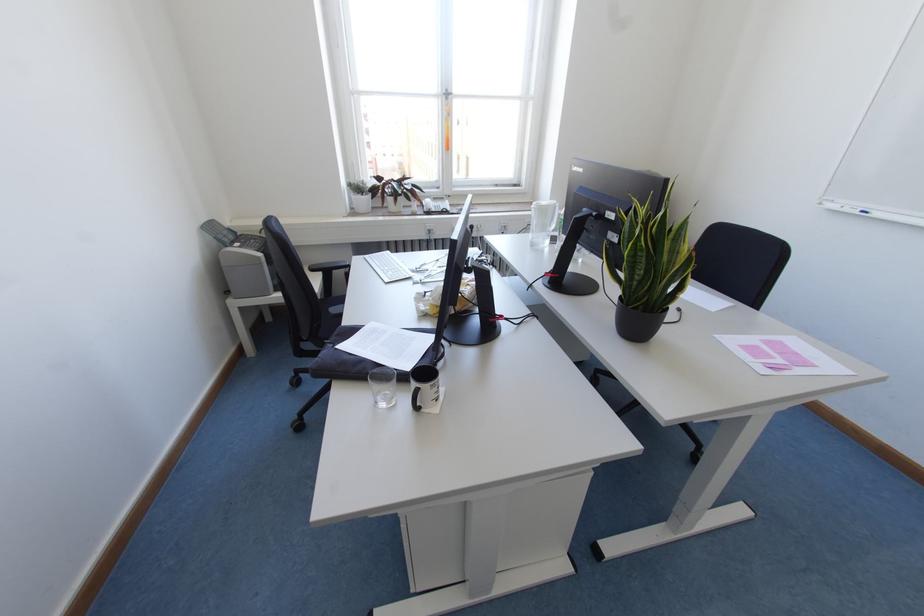
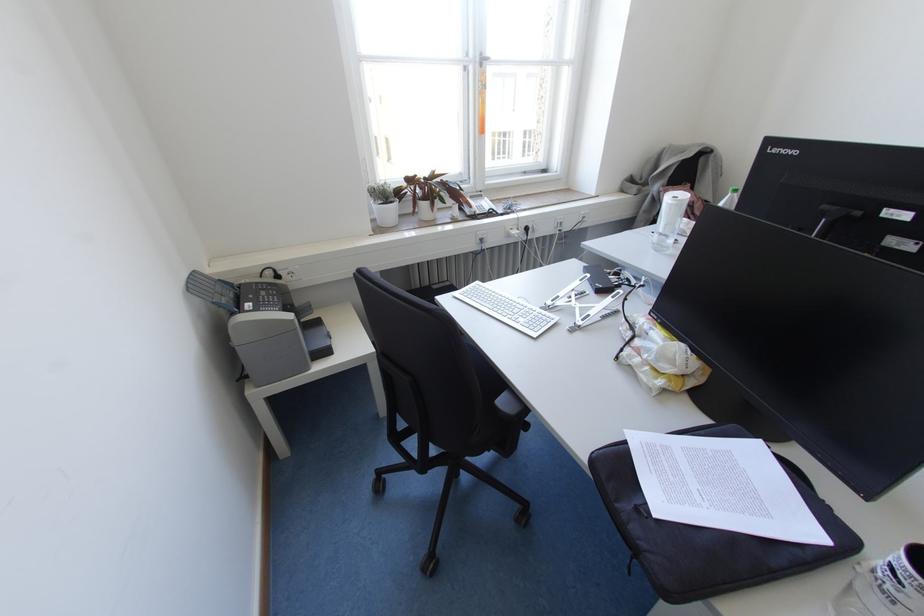
Where in the second image is the point corresponding to pixel 365 184 from the first image?

(390, 187)